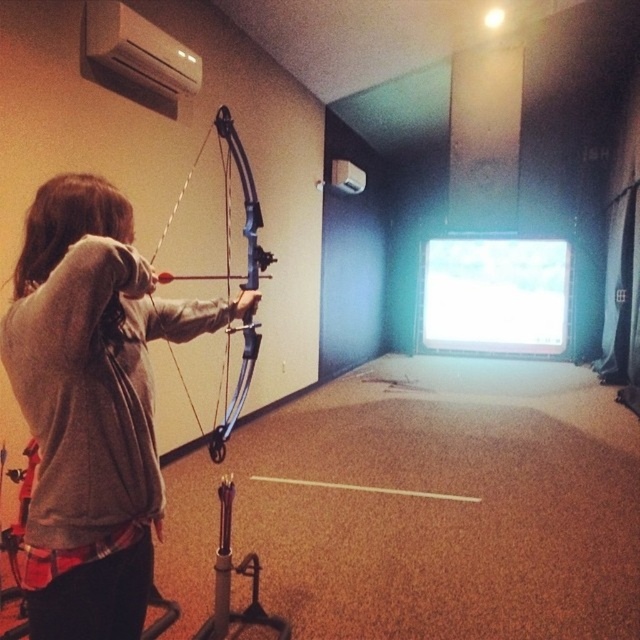
You are an archer preparing to shoot an arrow at the target on the screen. You notice a matte gray hoodie at left. Where exactly is the matte gray hoodie at left located in the room? Please provide coordinates in the format of point coordinates like point (92, 404). The coordinate system is from 0 to 1, with 0,0 being the bottom left corner of the room and 1,1 being the top right corner.

The matte gray hoodie at left is located at point (92, 404) in the room.

You are an archer preparing to shoot an arrow. You notice the matte gray hoodie at left and the blue matte bow at center in your line of sight. Which object is positioned lower in your view?

The matte gray hoodie at left is located below the blue matte bow at center, so it is positioned lower in your view.